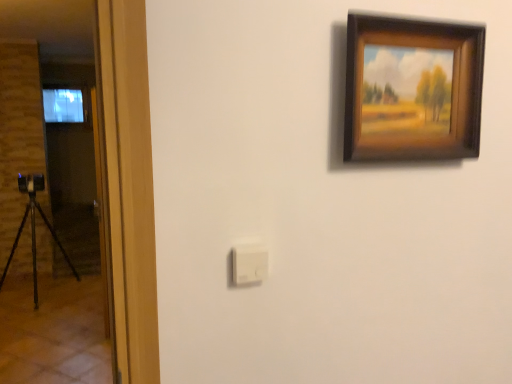
This screenshot has width=512, height=384. What do you see at coordinates (249, 264) in the screenshot?
I see `white plastic light switch at center` at bounding box center [249, 264].

Locate an element on the screen. white plastic light switch at center is located at coordinates (249, 264).

The image size is (512, 384). I want to click on wooden frame at upper right, so click(413, 89).

What do you see at coordinates (413, 89) in the screenshot? The image size is (512, 384). I see `wooden frame at upper right` at bounding box center [413, 89].

Identify the location of white plastic light switch at center. Image resolution: width=512 pixels, height=384 pixels. (x=249, y=264).

Considering the positions of objects white plastic light switch at center and wooden frame at upper right in the image provided, who is more to the left, white plastic light switch at center or wooden frame at upper right?

white plastic light switch at center.

Consider the image. Considering the relative positions of white plastic light switch at center and wooden frame at upper right in the image provided, is white plastic light switch at center in front of wooden frame at upper right?

That is False.

Which is more distant, (234,274) or (466,112)?

The point (466,112) is more distant.

Based on the photo, from the image's perspective, between white plastic light switch at center and wooden frame at upper right, who is located below?

white plastic light switch at center is shown below in the image.

From a real-world perspective, between white plastic light switch at center and wooden frame at upper right, who is vertically higher?

From a 3D spatial view, wooden frame at upper right is above.

In terms of width, does white plastic light switch at center look wider or thinner when compared to wooden frame at upper right?

Clearly, white plastic light switch at center has less width compared to wooden frame at upper right.

Considering the sizes of objects white plastic light switch at center and wooden frame at upper right in the image provided, who is taller, white plastic light switch at center or wooden frame at upper right?

With more height is wooden frame at upper right.

Between white plastic light switch at center and wooden frame at upper right, which one has larger size?

Bigger between the two is wooden frame at upper right.

Is wooden frame at upper right completely or partially inside white plastic light switch at center?

No, wooden frame at upper right is not inside white plastic light switch at center.

Is white plastic light switch at center not near wooden frame at upper right?

No, white plastic light switch at center is not far from wooden frame at upper right.

Is white plastic light switch at center facing towards wooden frame at upper right?

No, white plastic light switch at center is not oriented towards wooden frame at upper right.

Looking at this image, what's the angular difference between white plastic light switch at center and wooden frame at upper right's facing directions?

0.529 degrees separate the facing orientations of white plastic light switch at center and wooden frame at upper right.

Identify the location of light switch that appears behind the wooden frame at upper right. (249, 264).

Between wooden frame at upper right and white plastic light switch at center, which one appears on the right side from the viewer's perspective?

wooden frame at upper right.

Is wooden frame at upper right in front of white plastic light switch at center?

Yes, it is in front of white plastic light switch at center.

Which is further, [458,111] or [251,249]?

Point [458,111]

From the image's perspective, is wooden frame at upper right on top of white plastic light switch at center?

Correct, wooden frame at upper right appears higher than white plastic light switch at center in the image.

From a real-world perspective, is wooden frame at upper right on top of white plastic light switch at center?

Yes, from a real-world perspective, wooden frame at upper right is on top of white plastic light switch at center.

Is wooden frame at upper right wider than white plastic light switch at center?

Yes, wooden frame at upper right is wider than white plastic light switch at center.

Is wooden frame at upper right shorter than white plastic light switch at center?

In fact, wooden frame at upper right may be taller than white plastic light switch at center.

Considering the relative sizes of wooden frame at upper right and white plastic light switch at center in the image provided, is wooden frame at upper right smaller than white plastic light switch at center?

Actually, wooden frame at upper right might be larger than white plastic light switch at center.

Is wooden frame at upper right completely or partially outside of white plastic light switch at center?

That's correct, wooden frame at upper right is outside of white plastic light switch at center.

Would you say wooden frame at upper right is a long distance from white plastic light switch at center?

No, wooden frame at upper right is in close proximity to white plastic light switch at center.

Is wooden frame at upper right facing towards white plastic light switch at center?

No, wooden frame at upper right does not turn towards white plastic light switch at center.

How many degrees apart are the facing directions of wooden frame at upper right and white plastic light switch at center?

There is a 0.529-degree angle between the facing directions of wooden frame at upper right and white plastic light switch at center.

How far apart are wooden frame at upper right and white plastic light switch at center?

The distance of wooden frame at upper right from white plastic light switch at center is 48.63 centimeters.

Where is `light switch directly beneath the wooden frame at upper right (from a real-world perspective)`? The height and width of the screenshot is (384, 512). light switch directly beneath the wooden frame at upper right (from a real-world perspective) is located at coordinates (249, 264).

The width and height of the screenshot is (512, 384). In order to click on light switch below the wooden frame at upper right (from the image's perspective) in this screenshot , I will do `click(249, 264)`.

The height and width of the screenshot is (384, 512). Identify the location of picture frame above the white plastic light switch at center (from a real-world perspective). (413, 89).